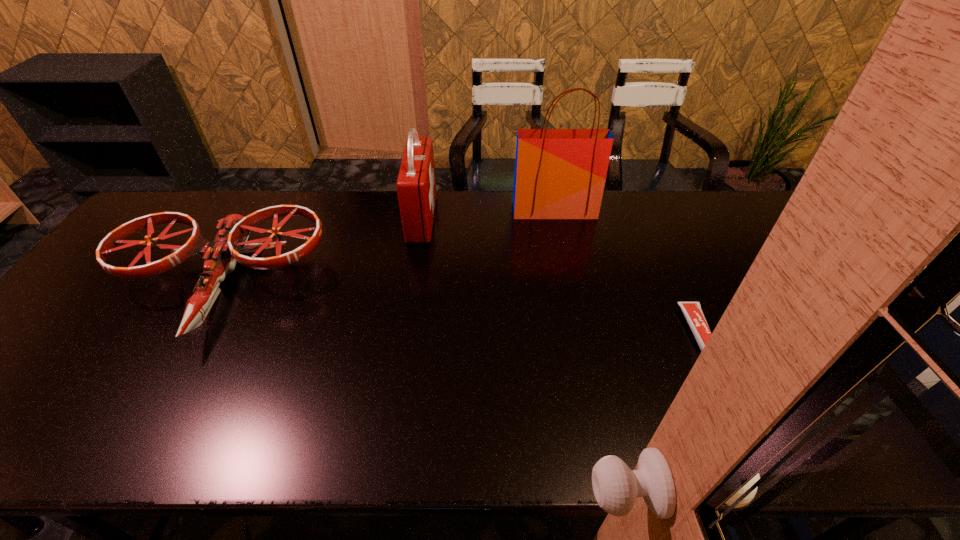
At what (x,y) coordinates should I click in order to perform the action: click on free space at the right edge of the desktop. Please return your answer as a coordinate pair (x, y). The height and width of the screenshot is (540, 960). Looking at the image, I should click on (904, 367).

This screenshot has height=540, width=960. I want to click on free spot between the second shortest object and the shopping bag, so click(387, 248).

Find the location of `vacant area between the third object from right to left and the tallest object`. vacant area between the third object from right to left and the tallest object is located at coordinates (488, 214).

Where is `vacant area that lies between the leftmost object and the second object from left to right`? Image resolution: width=960 pixels, height=540 pixels. vacant area that lies between the leftmost object and the second object from left to right is located at coordinates (321, 253).

At what (x,y) coordinates should I click in order to perform the action: click on vacant region between the second object from left to right and the tallest object. Please return your answer as a coordinate pair (x, y). This screenshot has height=540, width=960. Looking at the image, I should click on (488, 214).

The height and width of the screenshot is (540, 960). Find the location of `free area in between the tallest object and the first-aid kit`. free area in between the tallest object and the first-aid kit is located at coordinates (488, 214).

This screenshot has height=540, width=960. Identify the location of vacant space that's between the toothpaste and the shopping bag. (626, 272).

Where is `vacant space that's between the shopping bag and the third object from right to left`? The image size is (960, 540). vacant space that's between the shopping bag and the third object from right to left is located at coordinates (488, 214).

You are a GUI agent. You are given a task and a screenshot of the screen. Output one action in this format:
    pyautogui.click(x=<x>, y=<y>)
    Task: Click on the free space between the drone and the rightmost object
    The width and height of the screenshot is (960, 540).
    Given the screenshot: What is the action you would take?
    pyautogui.click(x=459, y=311)

What are the coordinates of `empty space that is in between the second tallest object and the toothpaste` in the screenshot? It's located at (560, 276).